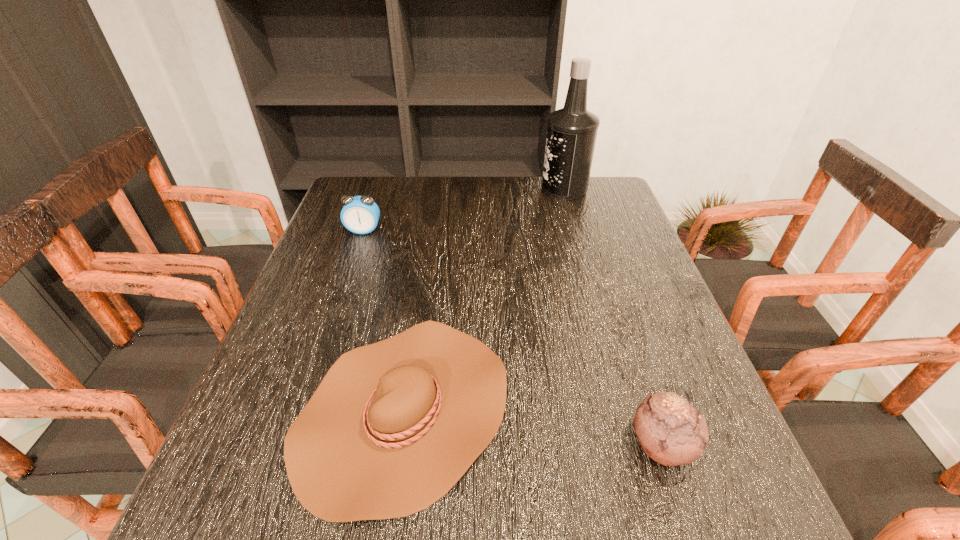
Where is `liquor`? The width and height of the screenshot is (960, 540). liquor is located at coordinates (571, 133).

Locate an element on the screen. the tallest object is located at coordinates (571, 133).

Locate an element on the screen. The height and width of the screenshot is (540, 960). the third nearest object is located at coordinates (360, 214).

This screenshot has height=540, width=960. What are the coordinates of `muffin` in the screenshot? It's located at (671, 431).

Where is `the shortest object`? the shortest object is located at coordinates (393, 426).

Where is `vacant space located 0.170m on the front label of the farthest object`? The height and width of the screenshot is (540, 960). vacant space located 0.170m on the front label of the farthest object is located at coordinates click(487, 188).

What are the coordinates of `vacant region located 0.230m on the front label of the farthest object` in the screenshot? It's located at (468, 188).

I want to click on vacant space located on the front label of the farthest object, so click(474, 188).

Image resolution: width=960 pixels, height=540 pixels. In order to click on vacant space located on the face of the second farthest object in this screenshot , I will do `click(323, 350)`.

What are the coordinates of `free space located on the back of the muffin` in the screenshot? It's located at (623, 330).